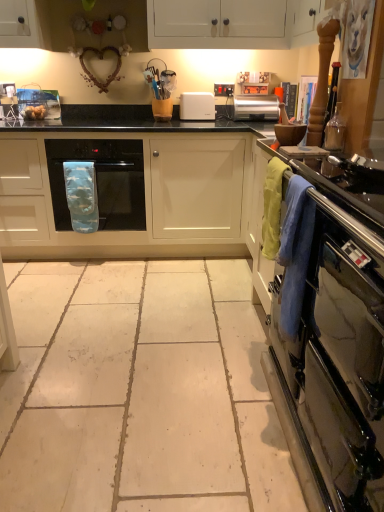
Question: Is white plastic toaster at center, which is counted as the 1th appliance, starting from the top, not inside clear glass bottle at right, arranged as the second appliance when viewed from the top?

Choices:
 (A) yes
 (B) no

Answer: (A)

Question: Is white plastic toaster at center, placed as the second appliance when sorted from bottom to top, thinner than clear glass bottle at right, the first appliance when ordered from right to left?

Choices:
 (A) yes
 (B) no

Answer: (B)

Question: From a real-world perspective, is white plastic toaster at center, which is the 2th appliance from front to back, positioned over clear glass bottle at right, marked as the second appliance in a back-to-front arrangement, based on gravity?

Choices:
 (A) no
 (B) yes

Answer: (B)

Question: Are white plastic toaster at center, placed as the second appliance when sorted from bottom to top, and clear glass bottle at right, marked as the second appliance in a back-to-front arrangement, beside each other?

Choices:
 (A) no
 (B) yes

Answer: (A)

Question: Does white plastic toaster at center, positioned as the first appliance in back-to-front order, have a lesser height compared to clear glass bottle at right, which ranks as the second appliance in left-to-right order?

Choices:
 (A) yes
 (B) no

Answer: (B)

Question: From a real-world perspective, is white plastic toaster at center, the first appliance positioned from the left, physically below clear glass bottle at right, the first appliance when ordered from right to left?

Choices:
 (A) no
 (B) yes

Answer: (A)

Question: Is stainless steel oven at right to the right of soft cotton towel at right from the viewer's perspective?

Choices:
 (A) no
 (B) yes

Answer: (B)

Question: Is stainless steel oven at right aimed at soft cotton towel at right?

Choices:
 (A) no
 (B) yes

Answer: (B)

Question: From the image's perspective, is stainless steel oven at right under soft cotton towel at right?

Choices:
 (A) no
 (B) yes

Answer: (B)

Question: Is stainless steel oven at right placed right next to soft cotton towel at right?

Choices:
 (A) no
 (B) yes

Answer: (A)

Question: Is stainless steel oven at right not close to soft cotton towel at right?

Choices:
 (A) yes
 (B) no

Answer: (B)

Question: Is stainless steel oven at right further to camera compared to soft cotton towel at right?

Choices:
 (A) yes
 (B) no

Answer: (B)

Question: Considering the relative positions of golden brown bread at left and silver metallic toaster at center in the image provided, is golden brown bread at left to the left of silver metallic toaster at center from the viewer's perspective?

Choices:
 (A) yes
 (B) no

Answer: (A)